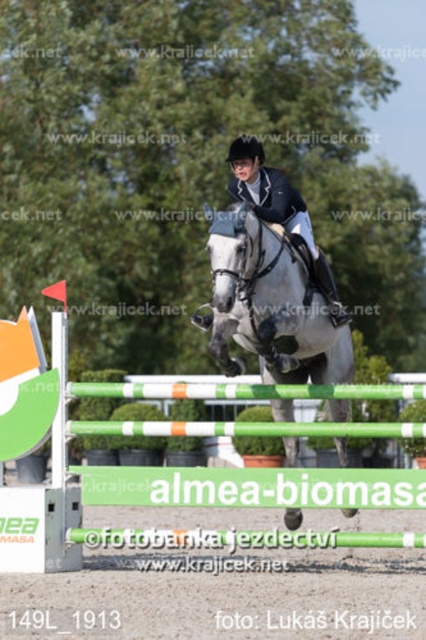
Is point (2, 525) positioned in front of point (333, 404)?

Yes.

Who is positioned more to the right, green plastic hurdle at center or white glossy horse at center?

white glossy horse at center is more to the right.

Is point (353, 493) positioned before point (282, 301)?

No, it is behind (282, 301).

The width and height of the screenshot is (426, 640). Find the location of `green plastic hurdle at center`. green plastic hurdle at center is located at coordinates (173, 481).